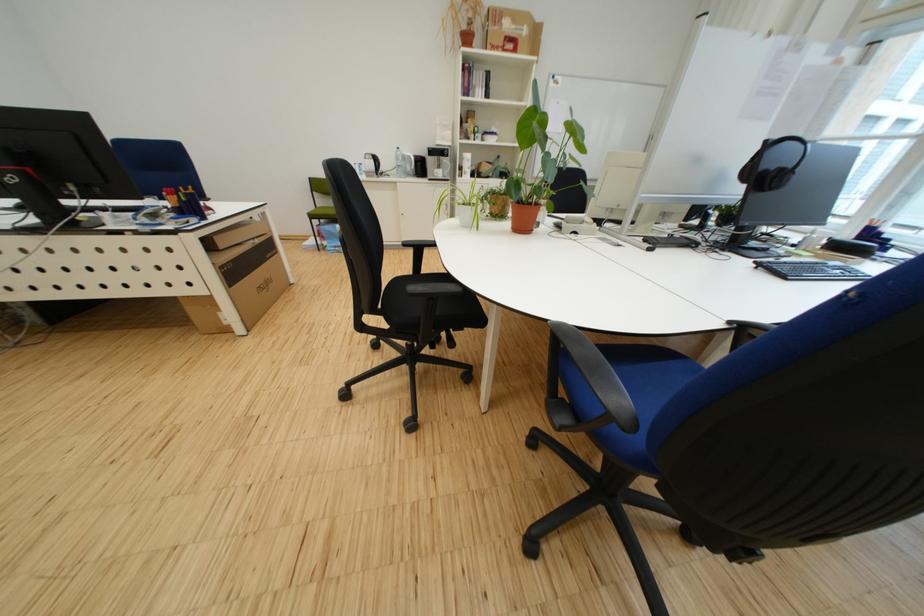
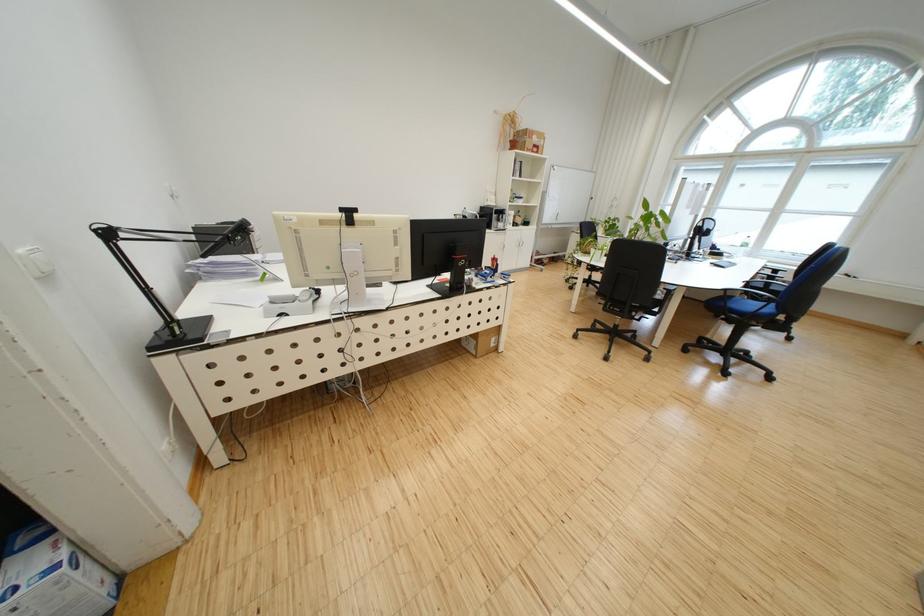
In the second image, find the point that corresponds to the point at 178,424 in the first image.

(572, 395)